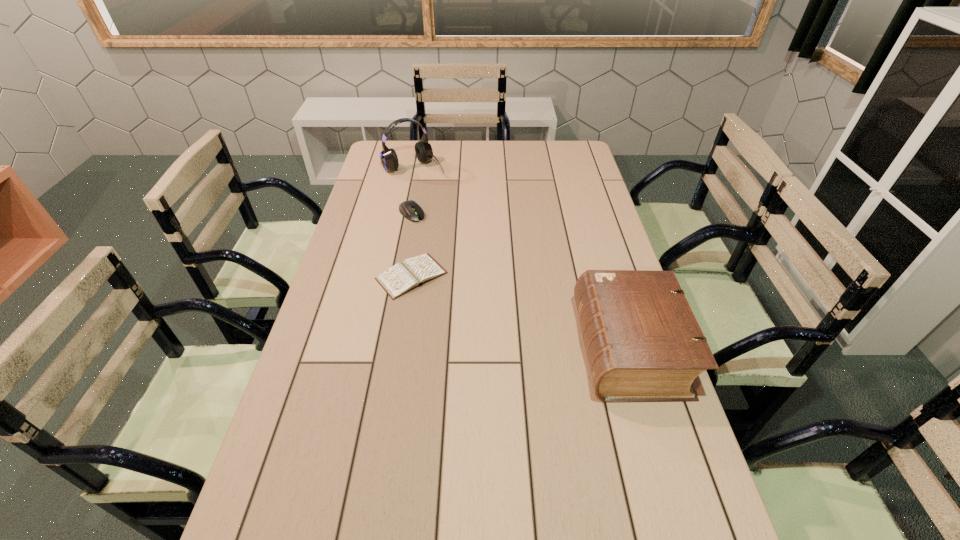
This screenshot has width=960, height=540. Find the location of `vacant space on the desktop that is between the second nearest object and the rightmost object and is positioned on the wheel side of the second farthest object`. vacant space on the desktop that is between the second nearest object and the rightmost object and is positioned on the wheel side of the second farthest object is located at coordinates (506, 307).

Locate an element on the screen. free space on the desktop that is between the diary and the second tallest object and is positioned on the ear cushions of the farthest object is located at coordinates (531, 315).